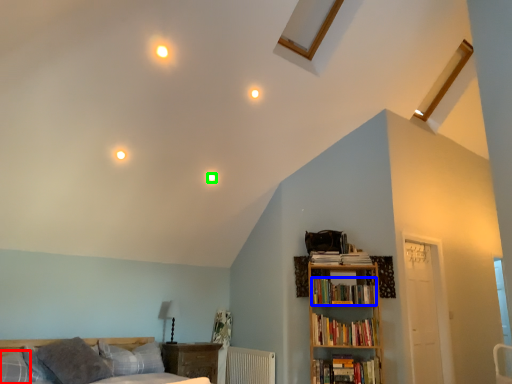
Question: Based on their relative distances, which object is farther from pillow (highlighted by a red box)? Choose from book (highlighted by a blue box) and lighting (highlighted by a green box).

Choices:
 (A) book
 (B) lighting

Answer: (A)